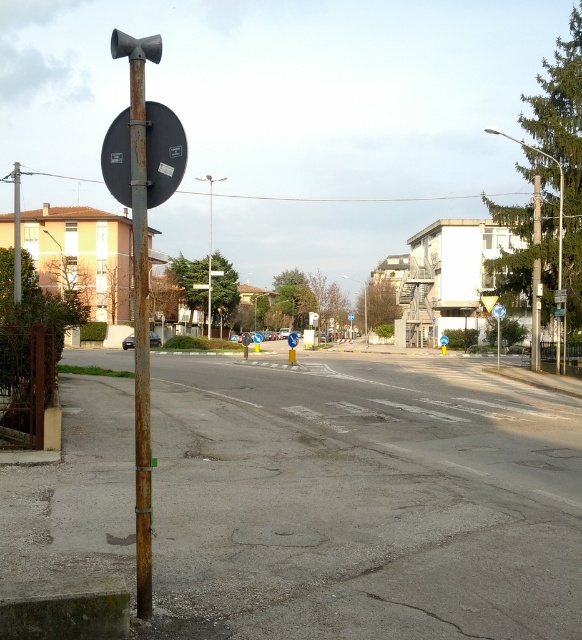
You are a delivery driver who needs to park your truck between the rusty metal pole at left and the metallic pole at right. Given that your truck is 3 meters long, can you fit it in the space between them?

The rusty metal pole at left is above the metallic pole at right, so there is no horizontal space between them for the truck to park. Therefore, the truck cannot fit between them.

You are a pedestrian standing on the sidewalk and see the metallic pole at right and the metallic reflective sign at upper center. Which object is positioned to the right side of the other?

The metallic pole at right is to the right of the metallic reflective sign at upper center.